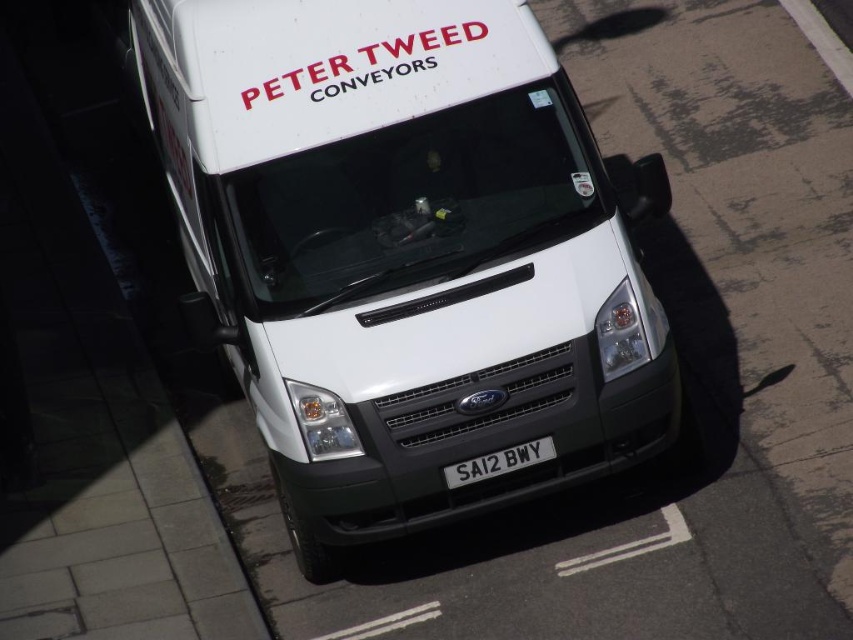
From the picture: You are a parking attendant who needs to fit a vehicle into a space that can only accommodate objects up to the size of the white metallic license plate at center. Can the white matte van at center fit into this space?

The white matte van at center is bigger than the white metallic license plate at center, so it cannot fit into the space designed for objects up to the size of the license plate.